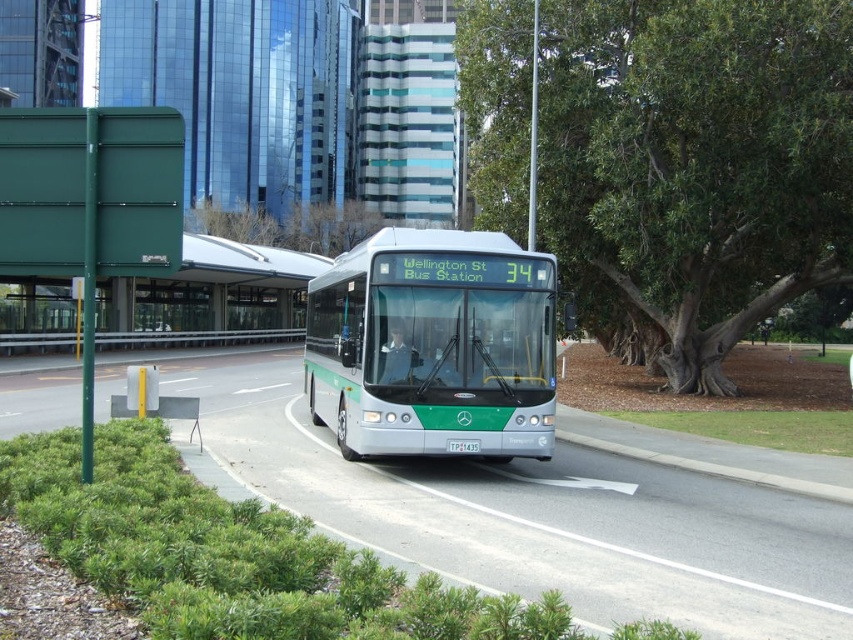
Question: Can you confirm if green metallic bus at center is bigger than silver metallic bus at center?

Choices:
 (A) yes
 (B) no

Answer: (A)

Question: Which of the following is the closest to the observer?

Choices:
 (A) (488, 131)
 (B) (310, 308)

Answer: (B)

Question: Which point appears farthest from the camera in this image?

Choices:
 (A) (805, 515)
 (B) (718, 92)
 (C) (383, 371)

Answer: (B)

Question: Does green metallic bus at center appear on the right side of silver metallic bus at center?

Choices:
 (A) no
 (B) yes

Answer: (A)

Question: Which of these objects is positioned closest to the green leafy tree at center?

Choices:
 (A) green metallic bus at center
 (B) silver metallic bus at center

Answer: (A)

Question: Can you confirm if green leafy tree at center is positioned below silver metallic bus at center?

Choices:
 (A) yes
 (B) no

Answer: (B)